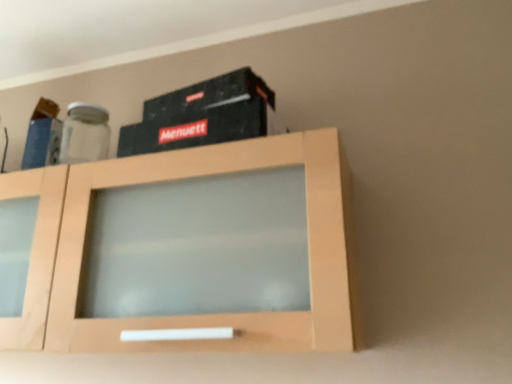
In order to click on black matte box at upper center in this screenshot , I will do `click(202, 115)`.

In order to face black matte box at upper center, should I rotate leftwards or rightwards?

To align with it, rotate left about 6.937°.

What do you see at coordinates (202, 115) in the screenshot? I see `black matte box at upper center` at bounding box center [202, 115].

Consider the image. Measure the distance between black matte box at upper center and camera.

black matte box at upper center is 85.47 centimeters away from camera.

What do you see at coordinates (189, 251) in the screenshot?
I see `light wood cabinet at center` at bounding box center [189, 251].

In order to click on light wood cabinet at center in this screenshot , I will do `click(189, 251)`.

This screenshot has width=512, height=384. What are the coordinates of `black matte box at upper center` in the screenshot? It's located at point(202,115).

Can you confirm if light wood cabinet at center is positioned to the left of black matte box at upper center?

Correct, you'll find light wood cabinet at center to the left of black matte box at upper center.

Is light wood cabinet at center positioned behind black matte box at upper center?

That is False.

Does point (265, 244) appear closer or farther from the camera than point (175, 135)?

Point (265, 244) is closer to the camera than point (175, 135).

From the image's perspective, which object appears higher, light wood cabinet at center or black matte box at upper center?

From the image's view, black matte box at upper center is above.

From a real-world perspective, is light wood cabinet at center above or below black matte box at upper center?

Clearly, from a real-world perspective, light wood cabinet at center is below black matte box at upper center.

Considering the sizes of objects light wood cabinet at center and black matte box at upper center in the image provided, who is thinner, light wood cabinet at center or black matte box at upper center?

Thinner between the two is black matte box at upper center.

Does light wood cabinet at center have a greater height compared to black matte box at upper center?

Yes.

Is light wood cabinet at center bigger than black matte box at upper center?

Yes, light wood cabinet at center is bigger than black matte box at upper center.

Is black matte box at upper center inside light wood cabinet at center?

That's incorrect, black matte box at upper center is not inside light wood cabinet at center.

Can you see light wood cabinet at center touching black matte box at upper center?

They are not placed beside each other.

Is light wood cabinet at center positioned with its back to black matte box at upper center?

light wood cabinet at center is not turned away from black matte box at upper center.

Can you tell me how much light wood cabinet at center and black matte box at upper center differ in facing direction?

The angular difference between light wood cabinet at center and black matte box at upper center is 5.04 degrees.

The height and width of the screenshot is (384, 512). Identify the location of cabinetry lying in front of the black matte box at upper center. (189, 251).

Is black matte box at upper center to the left of light wood cabinet at center from the viewer's perspective?

No.

Considering the relative positions of black matte box at upper center and light wood cabinet at center in the image provided, is black matte box at upper center behind light wood cabinet at center?

Yes, black matte box at upper center is further from the camera.

Does point (170, 115) lie behind point (336, 245)?

That is True.

From the image's perspective, which is above, black matte box at upper center or light wood cabinet at center?

black matte box at upper center.

From a real-world perspective, is black matte box at upper center located higher than light wood cabinet at center?

Indeed, from a real-world perspective, black matte box at upper center stands above light wood cabinet at center.

Considering the sizes of objects black matte box at upper center and light wood cabinet at center in the image provided, who is thinner, black matte box at upper center or light wood cabinet at center?

With smaller width is black matte box at upper center.

Is black matte box at upper center shorter than light wood cabinet at center?

Yes.

Considering the relative sizes of black matte box at upper center and light wood cabinet at center in the image provided, is black matte box at upper center bigger than light wood cabinet at center?

No, black matte box at upper center is not bigger than light wood cabinet at center.

Would you say black matte box at upper center contains light wood cabinet at center?

No, light wood cabinet at center is not surrounded by black matte box at upper center.

Is there a large distance between black matte box at upper center and light wood cabinet at center?

That's not correct — black matte box at upper center is a little close to light wood cabinet at center.

Could you tell me if black matte box at upper center is facing light wood cabinet at center?

No.

Image resolution: width=512 pixels, height=384 pixels. Find the location of `box located above the light wood cabinet at center (from a real-world perspective)`. box located above the light wood cabinet at center (from a real-world perspective) is located at coordinates (202, 115).

Locate an element on the screen. The width and height of the screenshot is (512, 384). cabinetry below the black matte box at upper center (from a real-world perspective) is located at coordinates (189, 251).

Where is `cabinetry below the black matte box at upper center (from the image's perspective)`? cabinetry below the black matte box at upper center (from the image's perspective) is located at coordinates (189, 251).